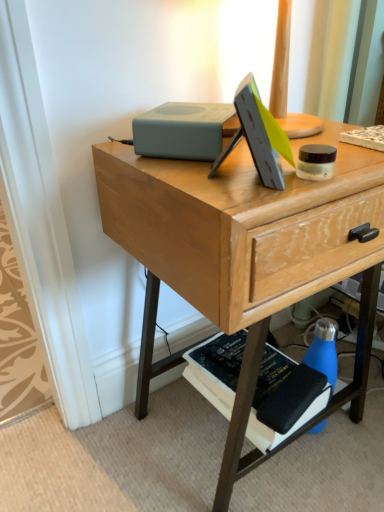
The width and height of the screenshot is (384, 512). I want to click on spots to the right of blue matte water bottle at lower right, so click(x=357, y=418).